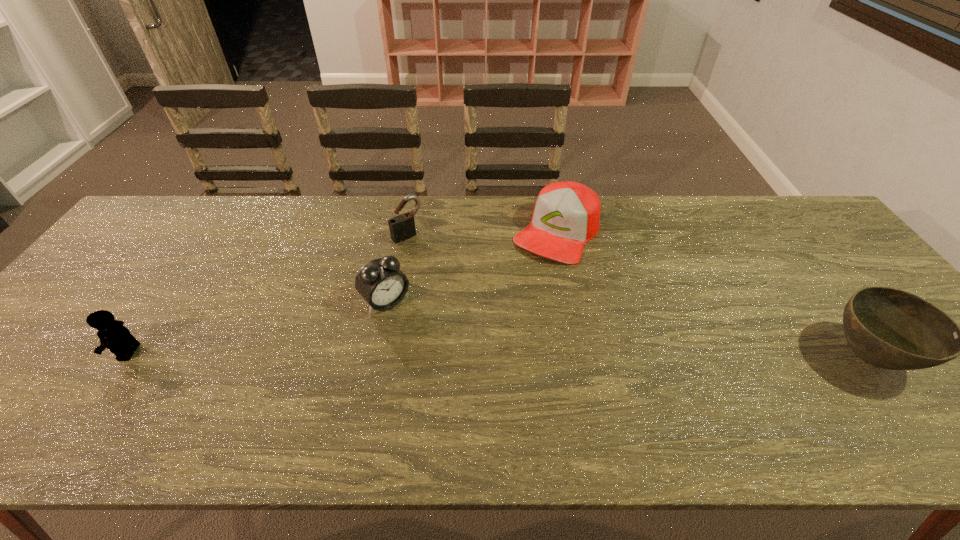
Find the location of a particular element. object situated at the near right corner is located at coordinates (889, 328).

Where is `vacant space at the far edge of the desktop`? vacant space at the far edge of the desktop is located at coordinates [x=731, y=214].

Locate an element on the screen. The height and width of the screenshot is (540, 960). free spot at the near edge of the desktop is located at coordinates point(682,375).

What are the coordinates of `vacant area at the left edge` in the screenshot? It's located at (166, 255).

Locate an element on the screen. This screenshot has height=540, width=960. vacant space at the far right corner is located at coordinates (764, 219).

Image resolution: width=960 pixels, height=540 pixels. What are the coordinates of `free point between the Lego and the baseball cap` in the screenshot? It's located at (343, 292).

This screenshot has width=960, height=540. Find the location of `free spot between the alarm clock and the Lego`. free spot between the alarm clock and the Lego is located at coordinates (257, 327).

The image size is (960, 540). In order to click on free area in between the padlock and the Lego in this screenshot , I will do `click(268, 294)`.

Locate an element on the screen. Image resolution: width=960 pixels, height=540 pixels. empty space that is in between the baseball cap and the padlock is located at coordinates (482, 234).

Find the location of a particular element. The height and width of the screenshot is (540, 960). free area in between the third nearest object and the baseball cap is located at coordinates pyautogui.click(x=471, y=267).